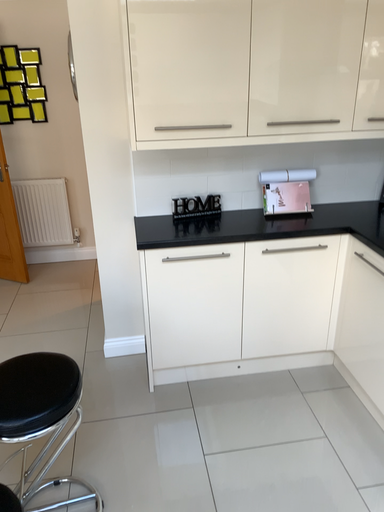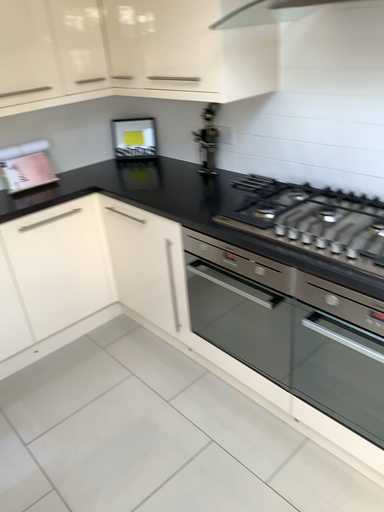
Question: How did the camera likely rotate when shooting the video?

Choices:
 (A) rotated left
 (B) rotated right

Answer: (B)